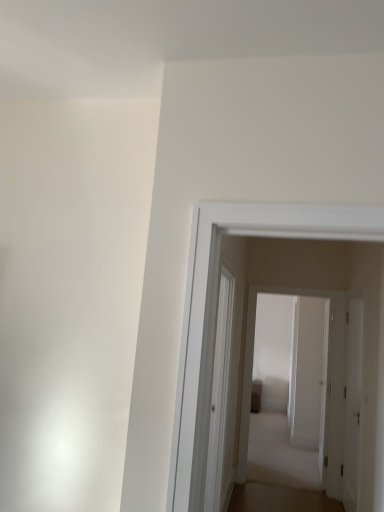
Question: Is white glossy door at center, which appears as the 1th door when viewed from the back, in front of or behind white matte door at right, positioned as the 2th door in back-to-front order, in the image?

Choices:
 (A) front
 (B) behind

Answer: (B)

Question: From a real-world perspective, is white glossy door at center, which appears as the 1th door when viewed from the back, positioned above or below white matte door at right, positioned as the 2th door in back-to-front order?

Choices:
 (A) above
 (B) below

Answer: (A)

Question: Which of these objects is positioned closest to the white glossy door at center, acting as the 2th door starting from the front?

Choices:
 (A) transparent glass door at center
 (B) white matte door at right, which is the first door from front to back

Answer: (B)

Question: Estimate the real-world distances between objects in this image. Which object is farther from the transparent glass door at center?

Choices:
 (A) white matte door at right, positioned as the 2th door in back-to-front order
 (B) white glossy door at center, acting as the 2th door starting from the front

Answer: (B)